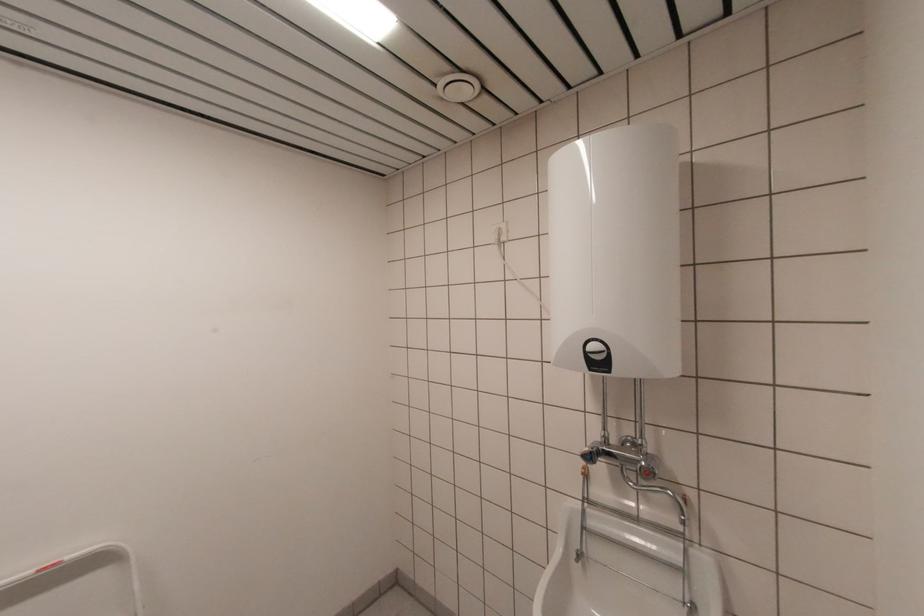
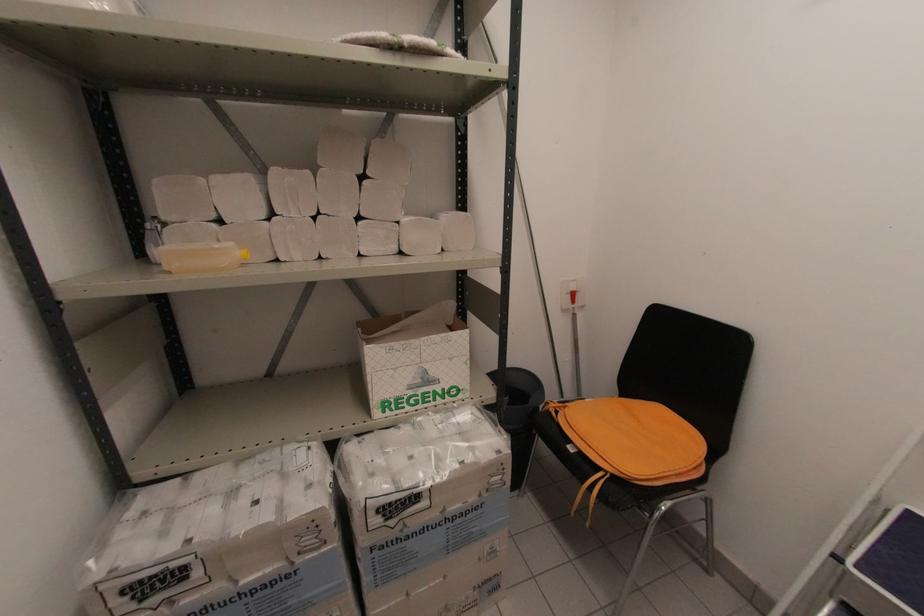
First-person continuous shooting, in which direction is the camera rotating?

The camera rotated toward left-down.